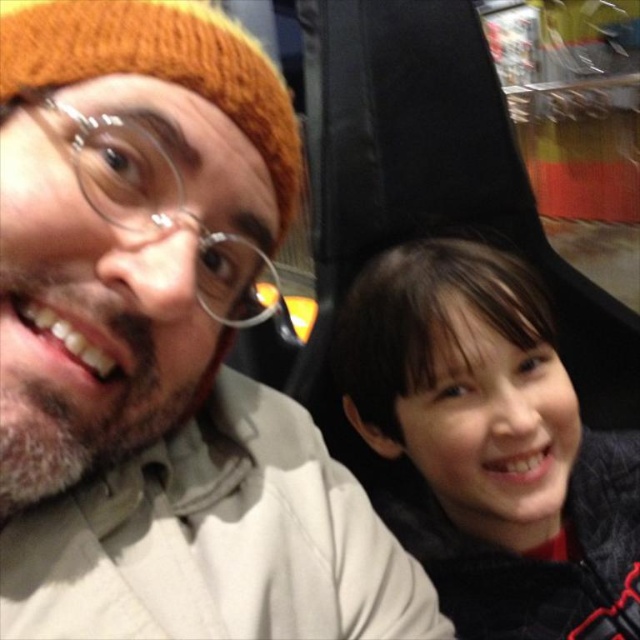
Is knitted wool hat at upper left below dark brown hair at right?

No.

Can you confirm if knitted wool hat at upper left is thinner than dark brown hair at right?

Yes.

What do you see at coordinates (161, 348) in the screenshot? I see `knitted wool hat at upper left` at bounding box center [161, 348].

Where is `knitted wool hat at upper left`? Image resolution: width=640 pixels, height=640 pixels. knitted wool hat at upper left is located at coordinates (161, 348).